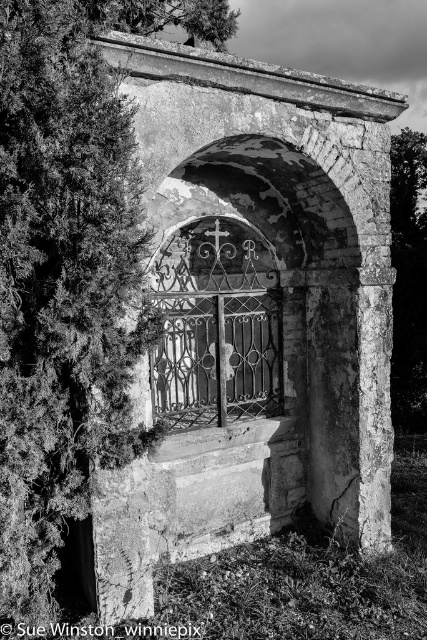
Consider the image. You are standing in front of the old stone structure and want to enter through the wrought iron gate at center. There is a green leafy tree at left nearby. Can you walk directly to the gate without going around the tree?

The green leafy tree at left is located above the wrought iron gate at center, so the tree is positioned higher up and does not block the path to the gate. You can walk directly to the wrought iron gate at center without needing to go around the tree.

You are a maintenance worker needing to reach the wrought iron gate at center and the green leafy tree at right. Your ladder is 4 meters long. Can you safely reach both objects with your ladder?

The wrought iron gate at center is 4.58 meters from the green leafy tree at right. Since the ladder is only 4 meters long, it is not long enough to safely reach both objects as the distance between them exceeds the ladder length.

You are standing in front of the stone structure and want to take a photo that includes both the green leafy tree at left and the green leafy tree at right. Which tree should you position closer to the center of the frame to ensure both are visible without cropping?

Since the green leafy tree at left is larger than the green leafy tree at right, you should position the green leafy tree at left closer to the center of the frame. This allows the smaller tree at the right to fit into the frame without being cropped while still highlighting the larger tree.